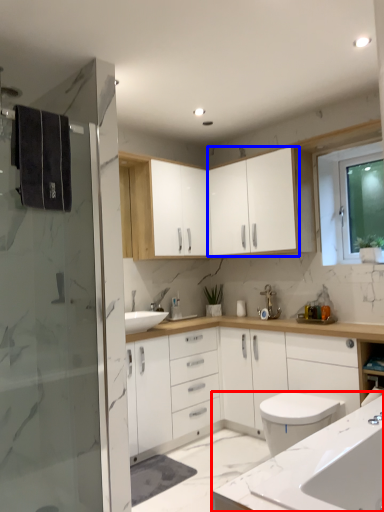
Question: Which of the following is the closest to the observer, countertop (highlighted by a red box) or cabinetry (highlighted by a blue box)?

Choices:
 (A) countertop
 (B) cabinetry

Answer: (A)